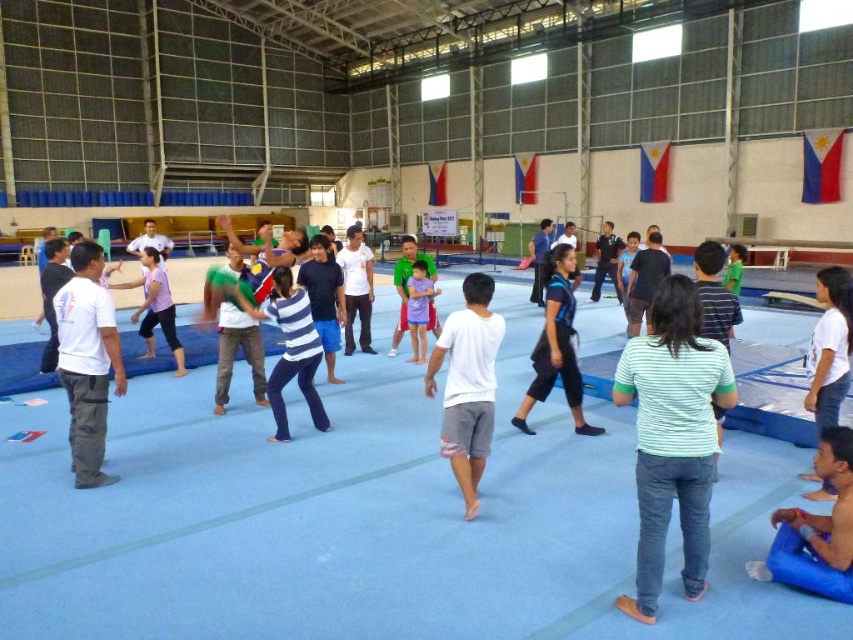
Can you confirm if green striped shirt at center is smaller than white matte pants at left?

Indeed, green striped shirt at center has a smaller size compared to white matte pants at left.

Is the position of green striped shirt at center more distant than that of white matte pants at left?

That is False.

Identify the location of green striped shirt at center. This screenshot has height=640, width=853. (672, 436).

Between point (461, 442) and point (535, 352), which one is positioned in front?

Point (461, 442) is in front.

From the picture: Is white cotton shirt at center to the left of blue matte shorts at center from the viewer's perspective?

Indeed, white cotton shirt at center is positioned on the left side of blue matte shorts at center.

Does point (456, 426) lie behind point (560, 250)?

No, it is not.

Where is `white cotton shirt at center`? The image size is (853, 640). white cotton shirt at center is located at coordinates (467, 385).

Is white matte pants at left shorter than white cotton shirt at center?

Incorrect, white matte pants at left's height does not fall short of white cotton shirt at center's.

Can you confirm if white matte pants at left is wider than white cotton shirt at center?

Indeed, white matte pants at left has a greater width compared to white cotton shirt at center.

Identify the location of white matte pants at left. (86, 362).

What are the coordinates of `white matte pants at left` in the screenshot? It's located at (86, 362).